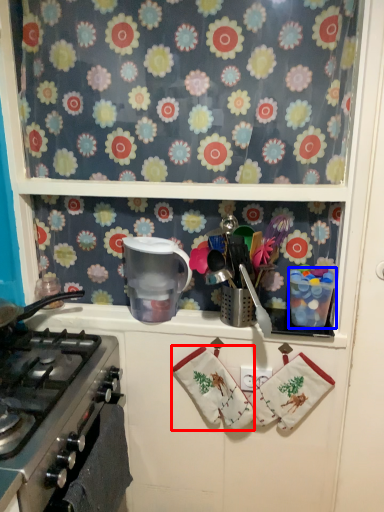
Question: Which object is further to the camera taking this photo, hand towel (highlighted by a red box) or appliance (highlighted by a blue box)?

Choices:
 (A) hand towel
 (B) appliance

Answer: (A)